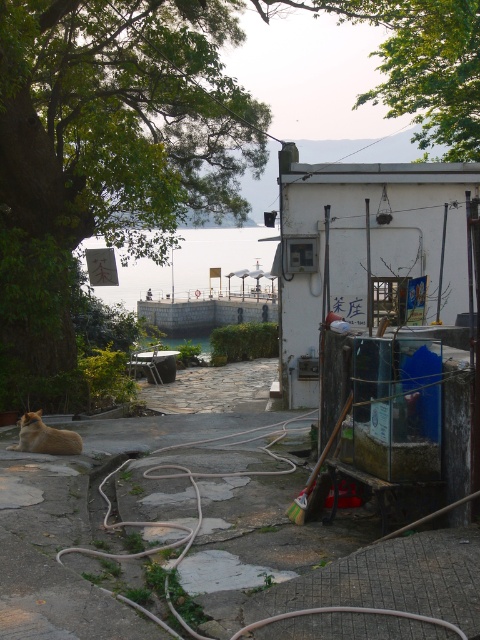
Question: Which point is farther to the camera?

Choices:
 (A) golden fur cat at lower left
 (B) white rubber garden hose at lower center
 (C) green leafy tree at upper left

Answer: (C)

Question: Which object appears closest to the camera in this image?

Choices:
 (A) white rubber garden hose at lower center
 (B) golden fur cat at lower left
 (C) green leafy tree at upper left

Answer: (A)

Question: Is the position of white rubber garden hose at lower center less distant than that of golden fur cat at lower left?

Choices:
 (A) no
 (B) yes

Answer: (B)

Question: In this image, where is green leafy tree at upper left located relative to white rubber garden hose at lower center?

Choices:
 (A) left
 (B) right

Answer: (A)

Question: Can you confirm if green leafy tree at upper left is positioned below white rubber garden hose at lower center?

Choices:
 (A) no
 (B) yes

Answer: (A)

Question: Among these objects, which one is nearest to the camera?

Choices:
 (A) white rubber garden hose at lower center
 (B) golden fur cat at lower left
 (C) green leafy tree at upper left

Answer: (A)